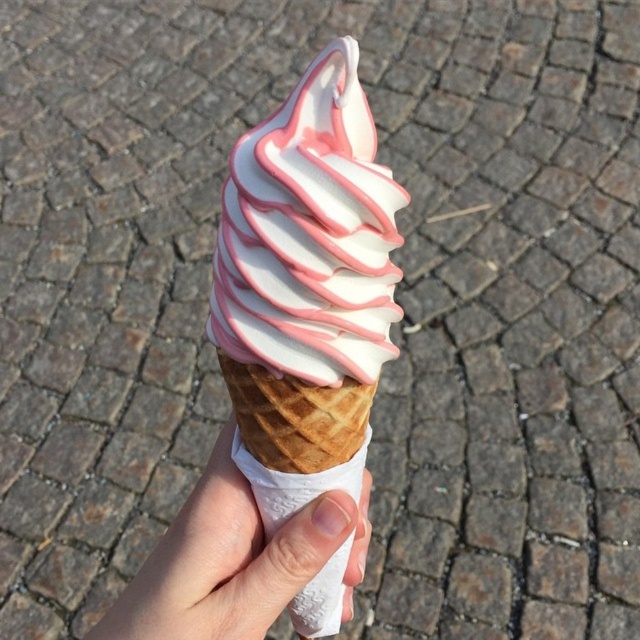
Question: Among these objects, which one is farthest from the camera?

Choices:
 (A) pink matte ice cream cone at center
 (B) white paper at center

Answer: (B)

Question: Does pink matte ice cream cone at center lie behind white paper at center?

Choices:
 (A) no
 (B) yes

Answer: (A)

Question: Is pink matte ice cream cone at center bigger than white paper at center?

Choices:
 (A) yes
 (B) no

Answer: (A)

Question: Which point is farther to the camera?

Choices:
 (A) (401, 198)
 (B) (160, 621)

Answer: (B)

Question: Is pink matte ice cream cone at center to the right of white paper at center from the viewer's perspective?

Choices:
 (A) yes
 (B) no

Answer: (A)